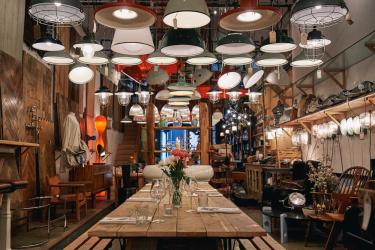
Find the location of a particular element. The image size is (375, 250). wooden table is located at coordinates (228, 231).